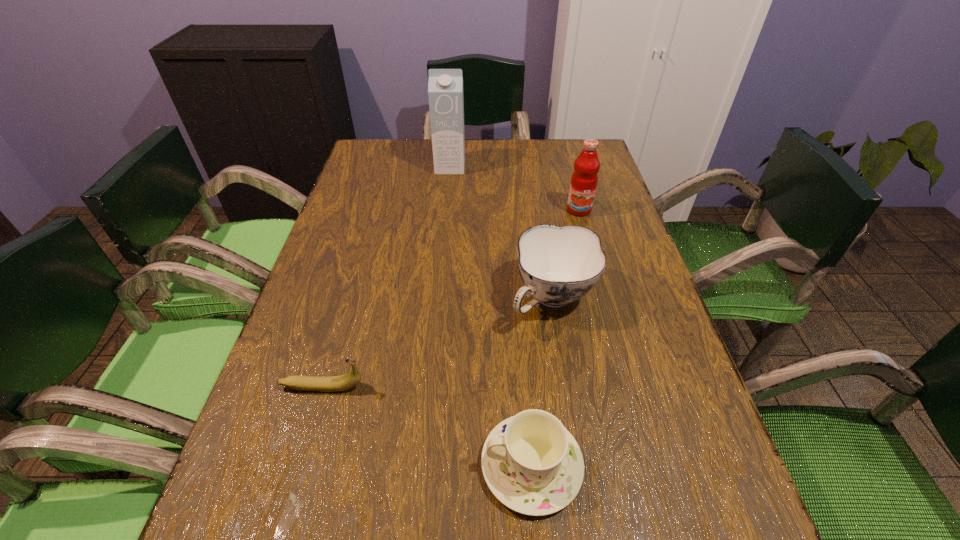
This screenshot has height=540, width=960. I want to click on chinaware that is positioned at the right edge, so click(x=558, y=265).

The image size is (960, 540). Identify the location of free space at the far edge. (542, 142).

The height and width of the screenshot is (540, 960). In order to click on free space at the left edge in this screenshot , I will do `click(353, 198)`.

The width and height of the screenshot is (960, 540). What are the coordinates of `free region at the right edge of the desktop` in the screenshot? It's located at (606, 224).

Identify the location of vacant space at the far left corner of the desktop. (376, 141).

Identify the location of vacant space at the far right corner. (574, 151).

Locate an element on the screen. The image size is (960, 540). vacant space in between the fourth shortest object and the nearest object is located at coordinates (555, 338).

Locate an element on the screen. Image resolution: width=960 pixels, height=540 pixels. free space between the farther chinaware and the shorter chinaware is located at coordinates (541, 382).

You are a GUI agent. You are given a task and a screenshot of the screen. Output one action in this format:
    pyautogui.click(x=<x>, y=<y>)
    Task: Click on the vacant space that's between the third shortest object and the second nearest object
    
    Given the screenshot: What is the action you would take?
    pyautogui.click(x=438, y=343)

Locate an element on the screen. This screenshot has width=960, height=540. vacant region between the fruit juice and the leftmost object is located at coordinates (451, 299).